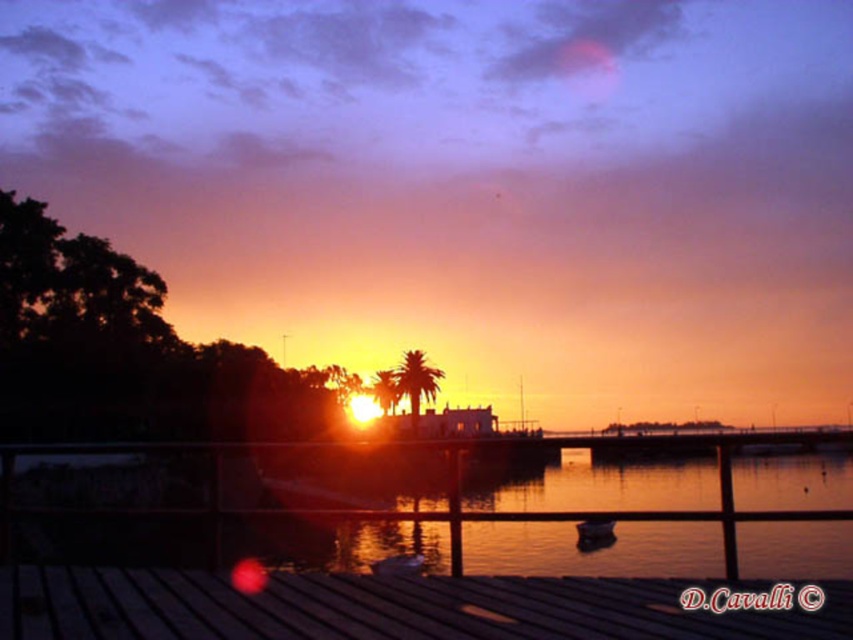
Question: Which point is closer to the camera?

Choices:
 (A) wooden boat at center
 (B) wooden at lower center

Answer: (B)

Question: Which object appears farthest from the camera in this image?

Choices:
 (A) wooden boat at center
 (B) wooden at lower center

Answer: (A)

Question: Can you confirm if wooden at lower center is bigger than wooden boat at center?

Choices:
 (A) no
 (B) yes

Answer: (A)

Question: Which object is closer to the camera taking this photo?

Choices:
 (A) wooden at lower center
 (B) wooden boat at center

Answer: (A)

Question: Does wooden at lower center have a larger size compared to wooden boat at center?

Choices:
 (A) yes
 (B) no

Answer: (B)

Question: Can you confirm if wooden at lower center is smaller than wooden boat at center?

Choices:
 (A) no
 (B) yes

Answer: (B)